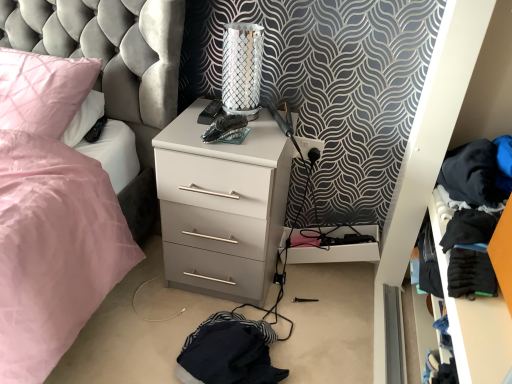
This screenshot has width=512, height=384. What are the coordinates of `vacant space situated on the left part of black fabric clothes at right` in the screenshot? It's located at (337, 339).